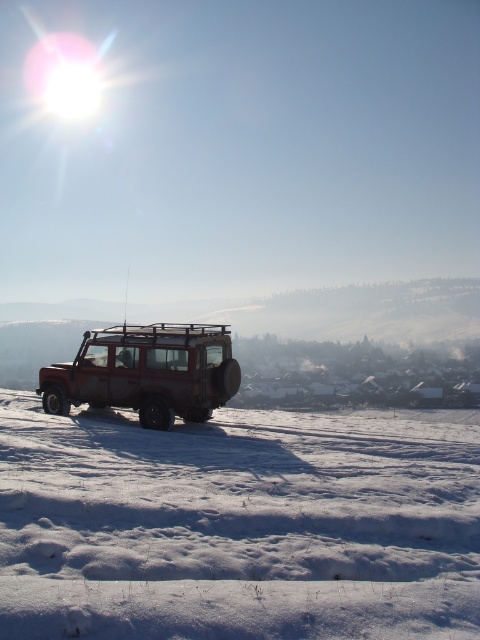
Which of these two, white powdery snow at center or rusty metal jeep at center, stands shorter?

With less height is white powdery snow at center.

Measure the distance between point (124, 436) and camera.

A distance of 11.45 meters exists between point (124, 436) and camera.

Does point (147, 612) come in front of point (154, 369)?

Yes.

I want to click on white powdery snow at center, so click(x=238, y=524).